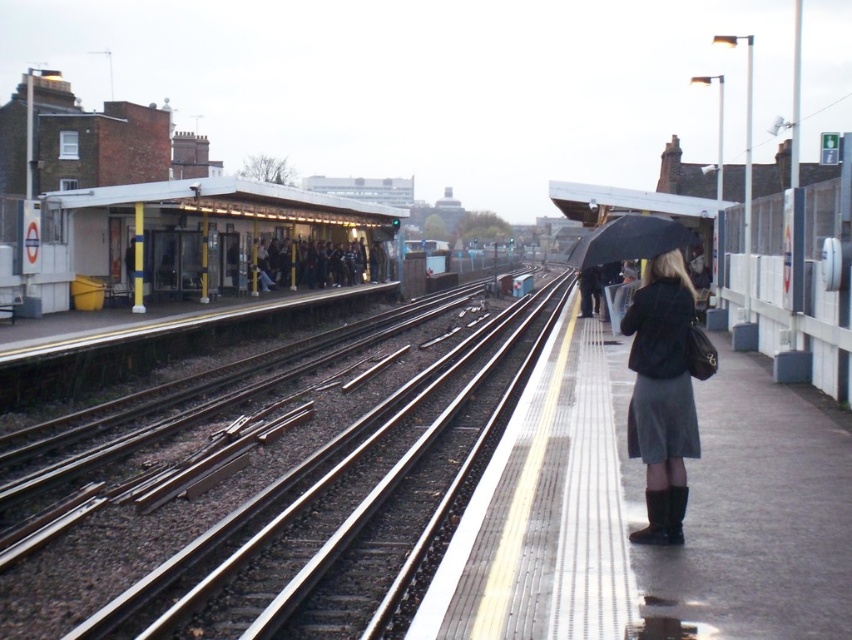
You are standing on the train station platform and see the point marked at coordinates (291, 502). What is located at that point?

The point marked at coordinates (291, 502) marks the location of the metal tracks at center.